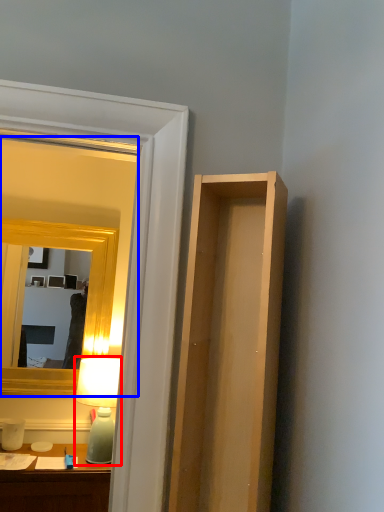
Question: Which of the following is the closest to the observer, table lamp (highlighted by a red box) or mirror (highlighted by a blue box)?

Choices:
 (A) table lamp
 (B) mirror

Answer: (A)